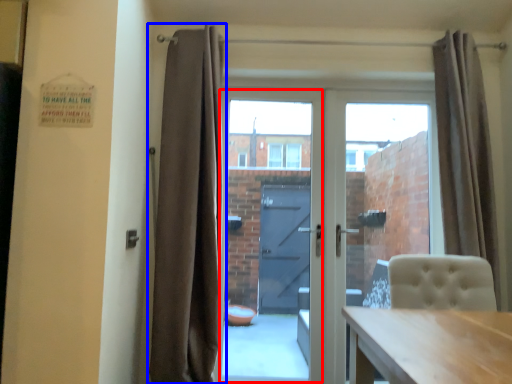
Question: Among these objects, which one is nearest to the camera, glass door (highlighted by a red box) or curtain (highlighted by a blue box)?

Choices:
 (A) glass door
 (B) curtain

Answer: (B)